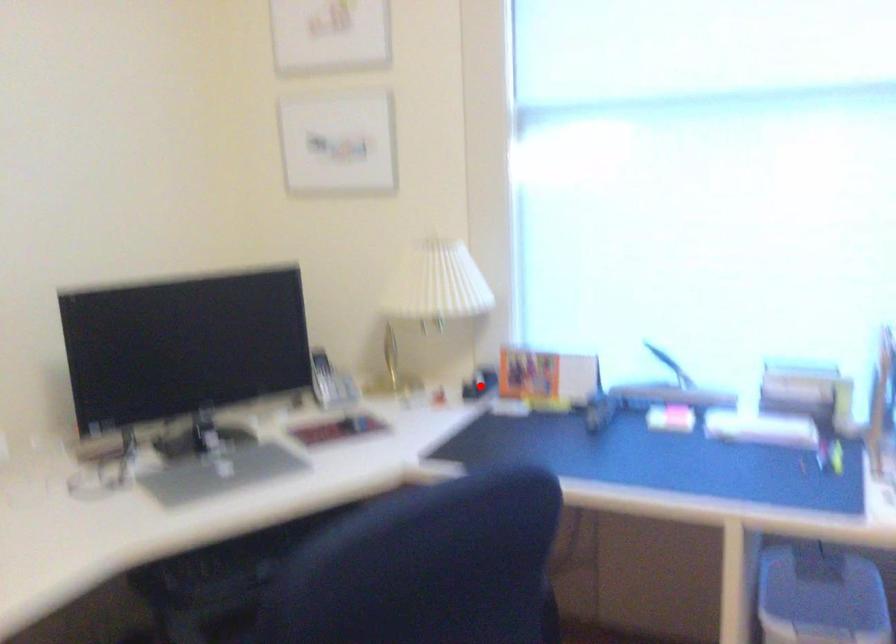
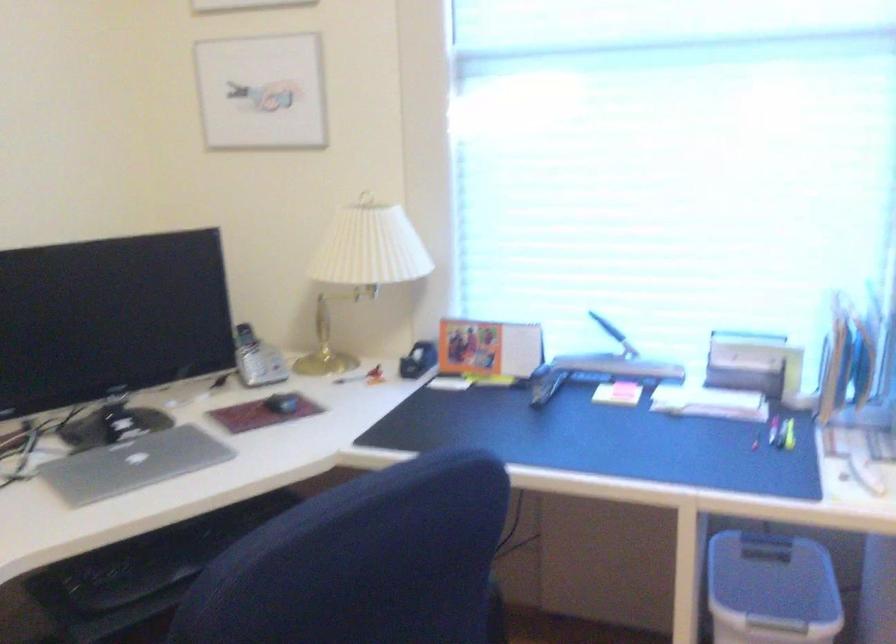
In the second image, find the point that corresponds to the highlighted location in the first image.

(418, 360)